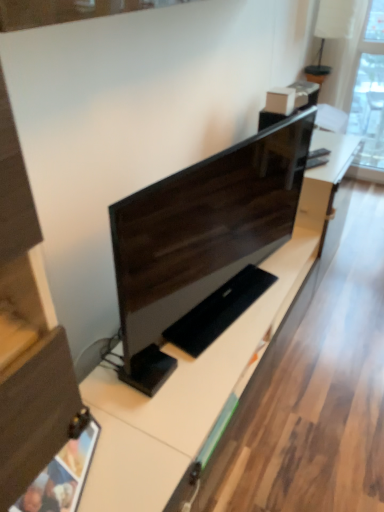
Question: Considering the relative positions of matte wood drawer at lower left and matte black monitor at center in the image provided, is matte wood drawer at lower left to the left or to the right of matte black monitor at center?

Choices:
 (A) right
 (B) left

Answer: (B)

Question: Looking at the image, does matte wood drawer at lower left seem bigger or smaller compared to matte black monitor at center?

Choices:
 (A) small
 (B) big

Answer: (A)

Question: From the image's perspective, is matte wood drawer at lower left above or below matte black monitor at center?

Choices:
 (A) below
 (B) above

Answer: (A)

Question: Is matte black monitor at center in front of or behind matte wood drawer at lower left in the image?

Choices:
 (A) front
 (B) behind

Answer: (B)

Question: Considering the relative positions of matte black monitor at center and matte wood drawer at lower left in the image provided, is matte black monitor at center to the left or to the right of matte wood drawer at lower left?

Choices:
 (A) right
 (B) left

Answer: (A)

Question: From their relative heights in the image, would you say matte black monitor at center is taller or shorter than matte wood drawer at lower left?

Choices:
 (A) short
 (B) tall

Answer: (B)

Question: Considering the positions of point (160, 194) and point (54, 411), is point (160, 194) closer or farther from the camera than point (54, 411)?

Choices:
 (A) closer
 (B) farther

Answer: (B)